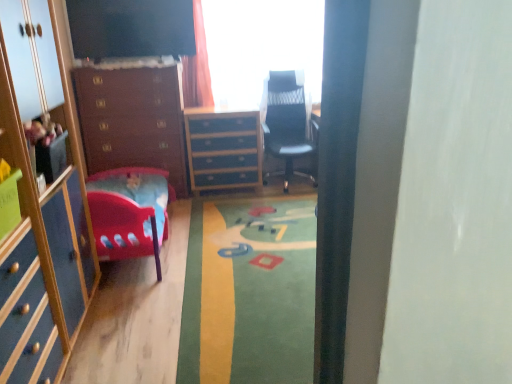
Question: Is blue painted wood chest of drawers at center, acting as the first chest of drawers starting from the right, located within transparent glass window at upper center?

Choices:
 (A) no
 (B) yes

Answer: (A)

Question: Is transparent glass window at upper center thinner than blue painted wood chest of drawers at center, acting as the first chest of drawers starting from the right?

Choices:
 (A) no
 (B) yes

Answer: (B)

Question: Does transparent glass window at upper center have a greater width compared to blue painted wood chest of drawers at center, which is counted as the 2th chest of drawers, starting from the left?

Choices:
 (A) yes
 (B) no

Answer: (B)

Question: Does transparent glass window at upper center have a lesser height compared to blue painted wood chest of drawers at center, acting as the first chest of drawers starting from the right?

Choices:
 (A) no
 (B) yes

Answer: (A)

Question: From a real-world perspective, is transparent glass window at upper center physically above blue painted wood chest of drawers at center, acting as the first chest of drawers starting from the right?

Choices:
 (A) no
 (B) yes

Answer: (B)

Question: From the image's perspective, is wooden chest of drawers at left, marked as the first chest of drawers in a left-to-right arrangement, above or below blue painted wood chest of drawers at center, acting as the first chest of drawers starting from the right?

Choices:
 (A) above
 (B) below

Answer: (A)

Question: From a real-world perspective, is wooden chest of drawers at left, which is the second chest of drawers from right to left, positioned above or below blue painted wood chest of drawers at center, which is counted as the 2th chest of drawers, starting from the left?

Choices:
 (A) above
 (B) below

Answer: (A)

Question: Considering the positions of wooden chest of drawers at left, which is the second chest of drawers from right to left, and blue painted wood chest of drawers at center, which is counted as the 2th chest of drawers, starting from the left, in the image, is wooden chest of drawers at left, which is the second chest of drawers from right to left, wider or thinner than blue painted wood chest of drawers at center, which is counted as the 2th chest of drawers, starting from the left,?

Choices:
 (A) wide
 (B) thin

Answer: (A)

Question: Does point (99, 144) appear closer or farther from the camera than point (236, 178)?

Choices:
 (A) closer
 (B) farther

Answer: (A)

Question: Considering the positions of blue painted wood chest of drawers at center, acting as the first chest of drawers starting from the right, and transparent glass window at upper center in the image, is blue painted wood chest of drawers at center, acting as the first chest of drawers starting from the right, taller or shorter than transparent glass window at upper center?

Choices:
 (A) tall
 (B) short

Answer: (B)

Question: Is point (195, 140) closer or farther from the camera than point (306, 24)?

Choices:
 (A) closer
 (B) farther

Answer: (A)

Question: In the image, is blue painted wood chest of drawers at center, acting as the first chest of drawers starting from the right, positioned in front of or behind transparent glass window at upper center?

Choices:
 (A) behind
 (B) front

Answer: (A)

Question: Looking at their shapes, would you say blue painted wood chest of drawers at center, acting as the first chest of drawers starting from the right, is wider or thinner than transparent glass window at upper center?

Choices:
 (A) thin
 (B) wide

Answer: (B)

Question: Relative to transparent glass window at upper center, is wooden chest of drawers at left, which is the second chest of drawers from right to left, in front or behind?

Choices:
 (A) front
 (B) behind

Answer: (A)

Question: Choose the correct answer: Is wooden chest of drawers at left, marked as the first chest of drawers in a left-to-right arrangement, inside transparent glass window at upper center or outside it?

Choices:
 (A) inside
 (B) outside

Answer: (B)